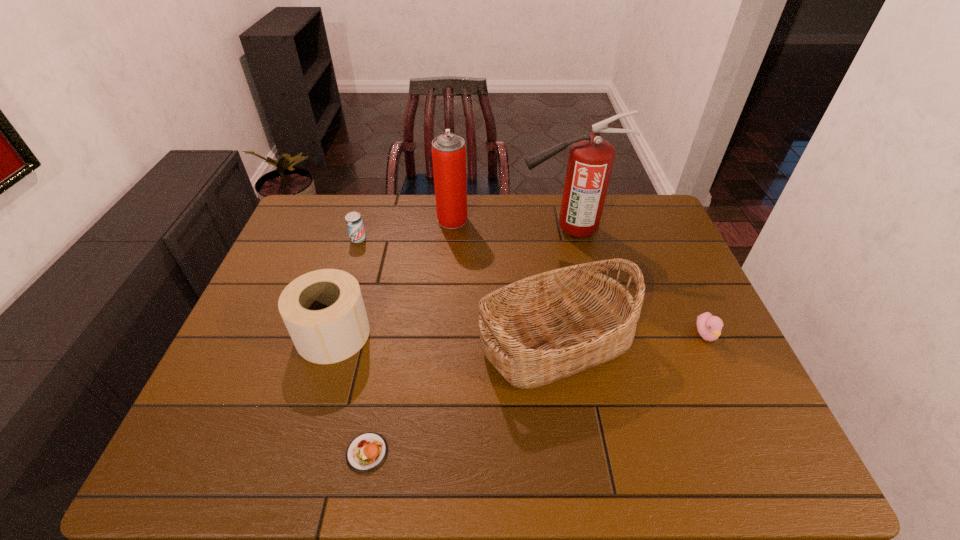
Find the location of a particular element. The height and width of the screenshot is (540, 960). aerosol can at the far edge is located at coordinates (448, 150).

Image resolution: width=960 pixels, height=540 pixels. What are the coordinates of `beer can at the far edge` in the screenshot? It's located at (354, 222).

Identify the location of object at the near edge. This screenshot has width=960, height=540. (366, 452).

Locate an element on the screen. object at the left edge is located at coordinates (323, 310).

Locate an element on the screen. object positioned at the right edge is located at coordinates (709, 327).

The height and width of the screenshot is (540, 960). I want to click on free space at the far edge of the desktop, so click(x=375, y=211).

In the image, there is a desktop. At what (x,y) coordinates should I click in order to perform the action: click on free space at the near edge. Please return your answer as a coordinate pair (x, y). Looking at the image, I should click on (504, 465).

Locate an element on the screen. This screenshot has height=540, width=960. vacant point at the left edge is located at coordinates (238, 349).

This screenshot has height=540, width=960. I want to click on blank space at the right edge, so click(715, 357).

You are a GUI agent. You are given a task and a screenshot of the screen. Output one action in this format:
    pyautogui.click(x=<x>, y=<y>)
    Task: Click on the free space at the far left corner of the desktop
    
    Given the screenshot: What is the action you would take?
    pyautogui.click(x=335, y=235)